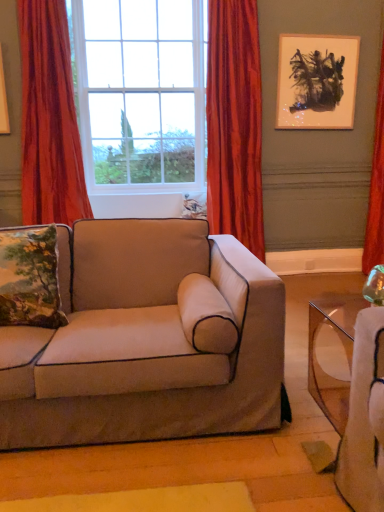
Question: Visually, is suede beige couch at center positioned to the left or to the right of clear glass window at center?

Choices:
 (A) right
 (B) left

Answer: (A)

Question: Looking at the image, does suede beige couch at center seem bigger or smaller compared to clear glass window at center?

Choices:
 (A) small
 (B) big

Answer: (A)

Question: Which is farther from the velvet orange curtain at left, the 1th curtain positioned from the left?

Choices:
 (A) red velvet curtain at right, the third curtain positioned from the left
 (B) suede beige couch at center
 (C) matte black painting at upper right
 (D) clear glass window at center
 (E) embroidered fabric pillow at left

Answer: (A)

Question: Which object is positioned farthest from the velvet-like red curtain at center, positioned as the second curtain in left-to-right order?

Choices:
 (A) embroidered fabric pillow at left
 (B) clear glass window at center
 (C) red velvet curtain at right, the third curtain positioned from the left
 (D) velvet orange curtain at left, the 1th curtain positioned from the left
 (E) suede beige couch at center

Answer: (A)